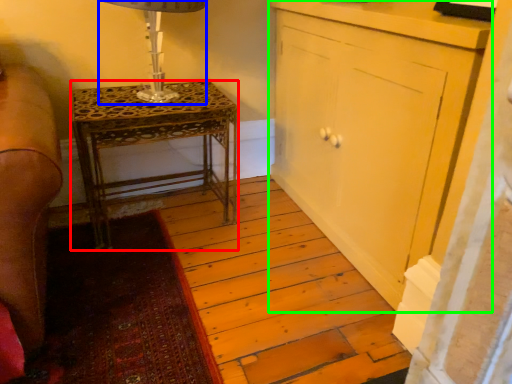
Question: Which is nearer to the nightstand (highlighted by a red box)? table lamp (highlighted by a blue box) or cabinetry (highlighted by a green box).

Choices:
 (A) table lamp
 (B) cabinetry

Answer: (A)